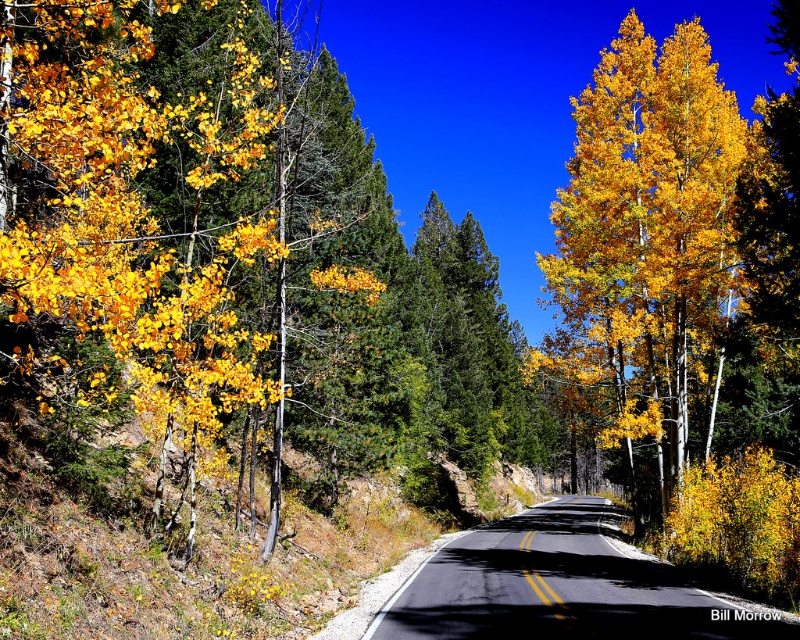
Question: Estimate the real-world distances between objects in this image. Which object is closer to the golden yellow leaves at left?

Choices:
 (A) black asphalt road at center
 (B) golden yellow leaves at right

Answer: (A)

Question: Which object is farther from the camera taking this photo?

Choices:
 (A) golden yellow leaves at left
 (B) golden yellow leaves at right

Answer: (B)

Question: Does golden yellow leaves at right appear on the left side of black asphalt road at center?

Choices:
 (A) yes
 (B) no

Answer: (B)

Question: Does golden yellow leaves at right have a larger size compared to black asphalt road at center?

Choices:
 (A) no
 (B) yes

Answer: (B)

Question: Which point is farther to the camera?

Choices:
 (A) golden yellow leaves at left
 (B) golden yellow leaves at right

Answer: (B)

Question: Can you confirm if golden yellow leaves at right is thinner than black asphalt road at center?

Choices:
 (A) no
 (B) yes

Answer: (A)